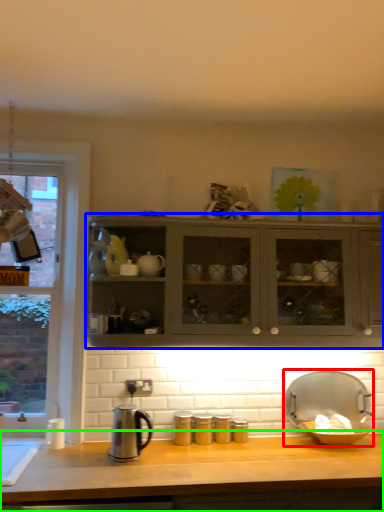
Question: Considering the real-world distances, which object is closest to appliance (highlighted by a red box)? cabinetry (highlighted by a blue box) or countertop (highlighted by a green box).

Choices:
 (A) cabinetry
 (B) countertop

Answer: (B)